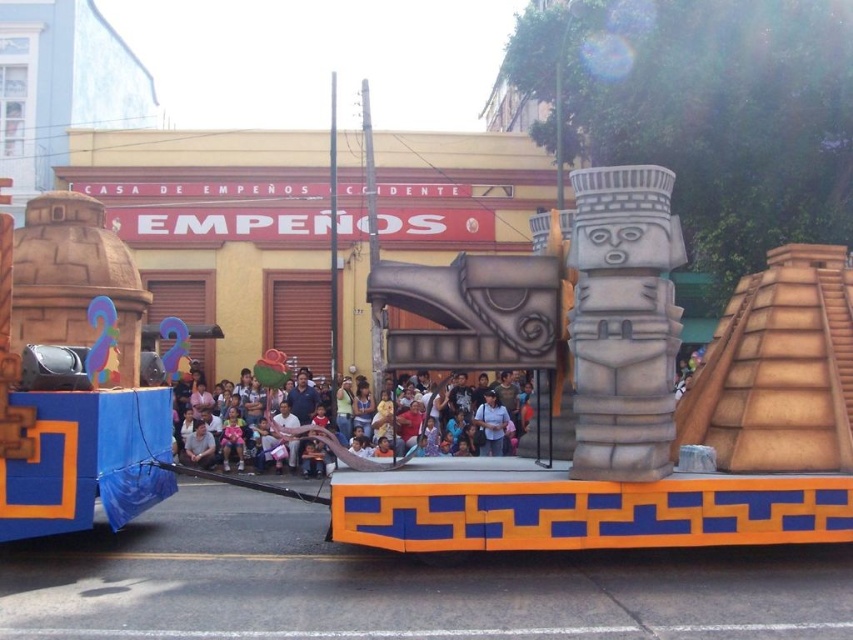
Question: Can you confirm if light brown fabric at center is positioned to the right of matte pink shirt at center?

Choices:
 (A) yes
 (B) no

Answer: (B)

Question: Among these points, which one is farthest from the camera?

Choices:
 (A) (393, 464)
 (B) (490, 403)

Answer: (B)

Question: Is light brown fabric at center further to the viewer compared to matte pink shirt at center?

Choices:
 (A) yes
 (B) no

Answer: (B)

Question: Can you confirm if light brown fabric at center is positioned to the left of matte pink shirt at center?

Choices:
 (A) no
 (B) yes

Answer: (B)

Question: Which point appears farthest from the camera in this image?

Choices:
 (A) (479, 404)
 (B) (308, 436)

Answer: (A)